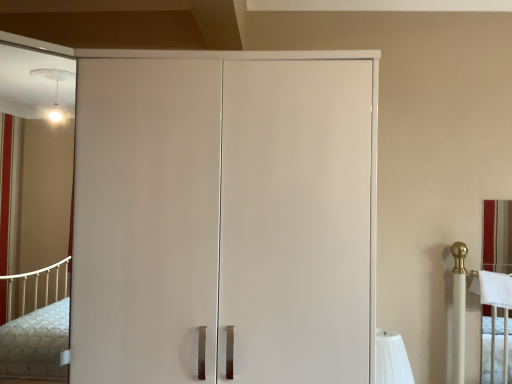
The height and width of the screenshot is (384, 512). Describe the element at coordinates (224, 216) in the screenshot. I see `white matte cabinet at center` at that location.

What are the coordinates of `white matte cabinet at center` in the screenshot? It's located at (224, 216).

Identify the location of white matte cabinet at center. (224, 216).